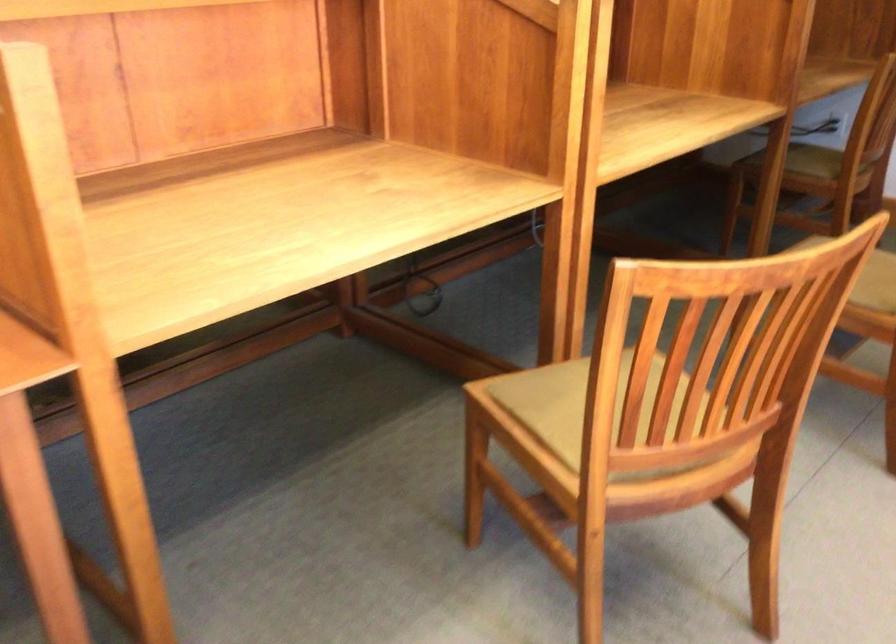
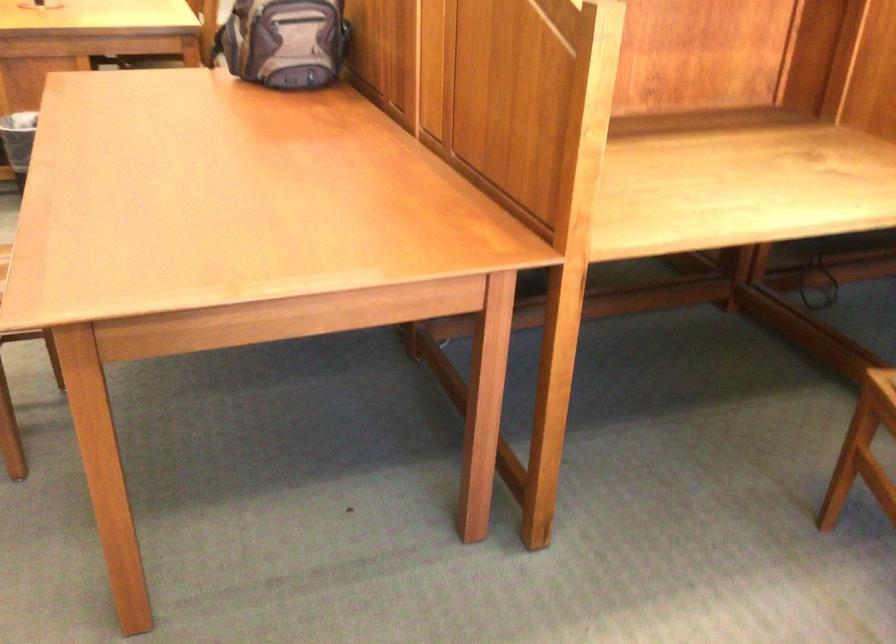
Which direction would the cameraman need to move to produce the second image?

The cameraman moved toward left, backward.